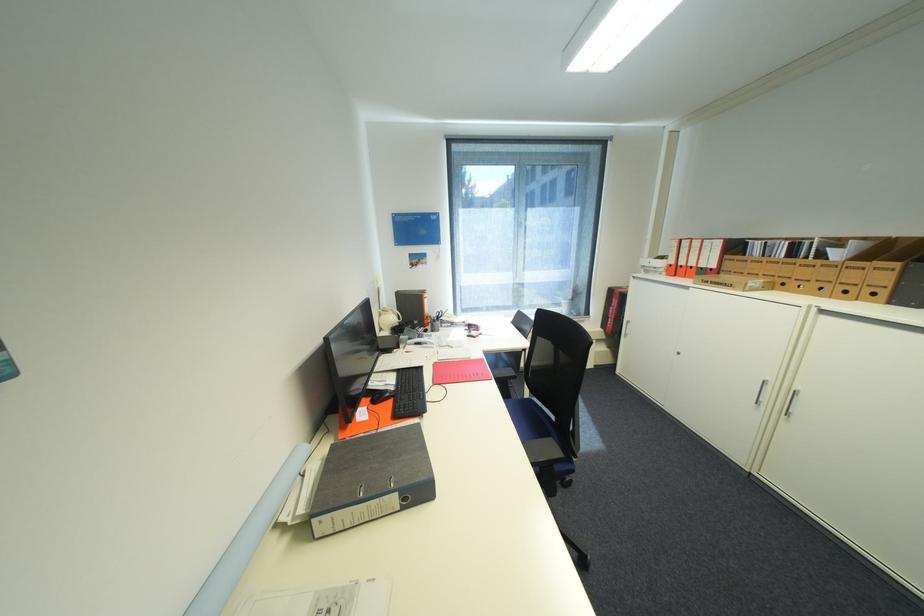
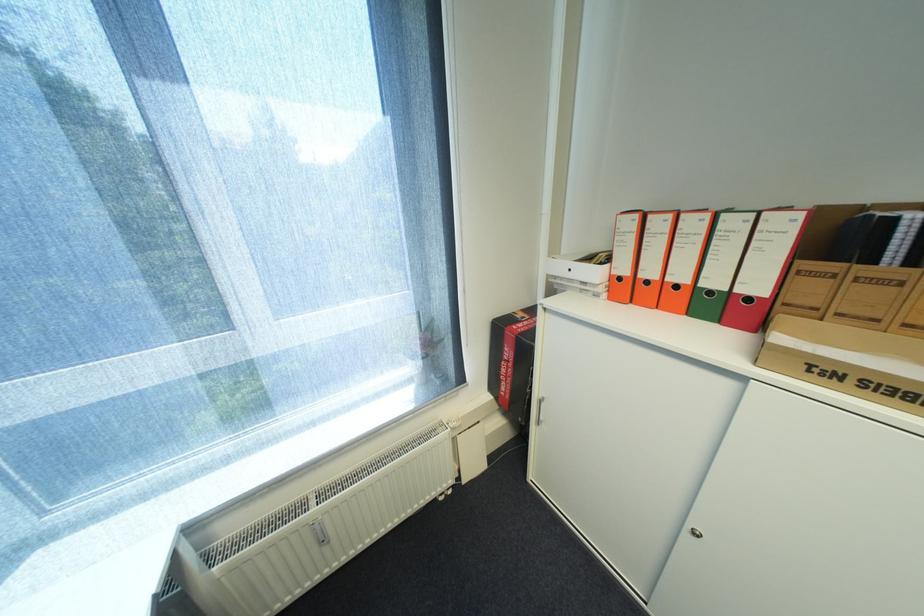
Where in the second image is the point corresponding to (x=688, y=267) from the first image?

(655, 283)